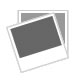
The height and width of the screenshot is (80, 80). I want to click on left side of a frame, so click(13, 46), click(19, 19).